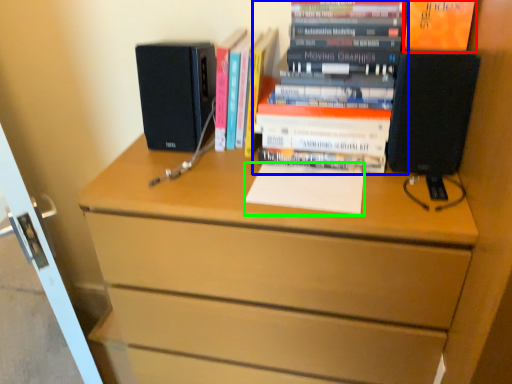
Question: Considering the real-world distances, which object is farthest from paperback book (highlighted by a red box)? book (highlighted by a blue box) or notepad (highlighted by a green box)?

Choices:
 (A) book
 (B) notepad

Answer: (B)